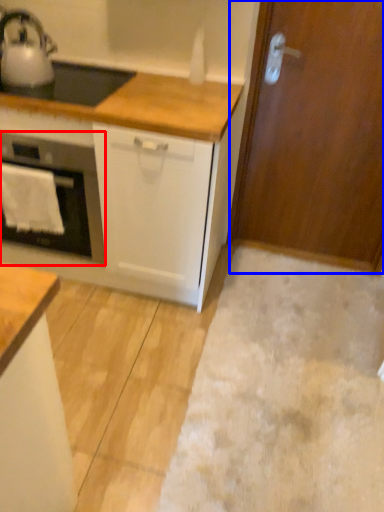
Question: Among these objects, which one is farthest to the camera, home appliance (highlighted by a red box) or door (highlighted by a blue box)?

Choices:
 (A) home appliance
 (B) door

Answer: (B)